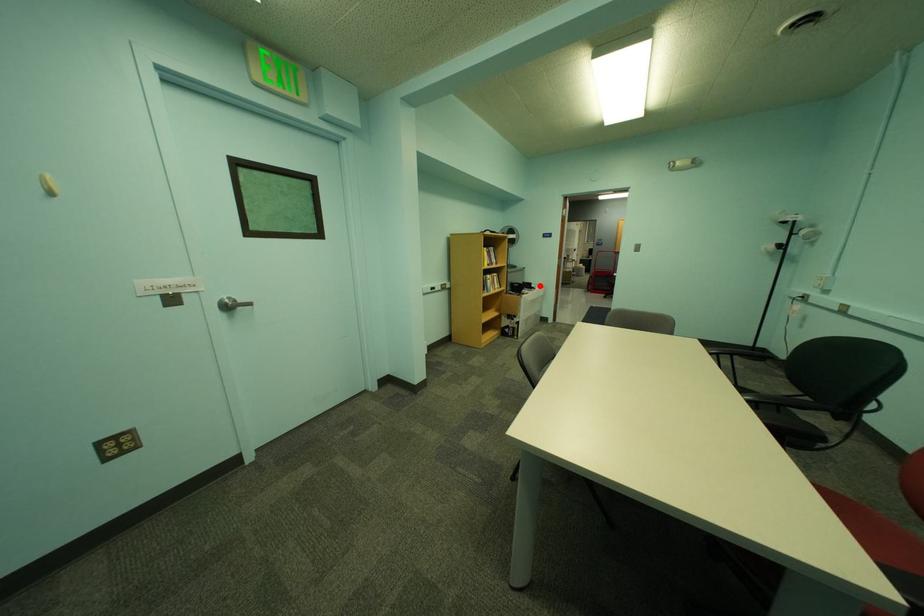
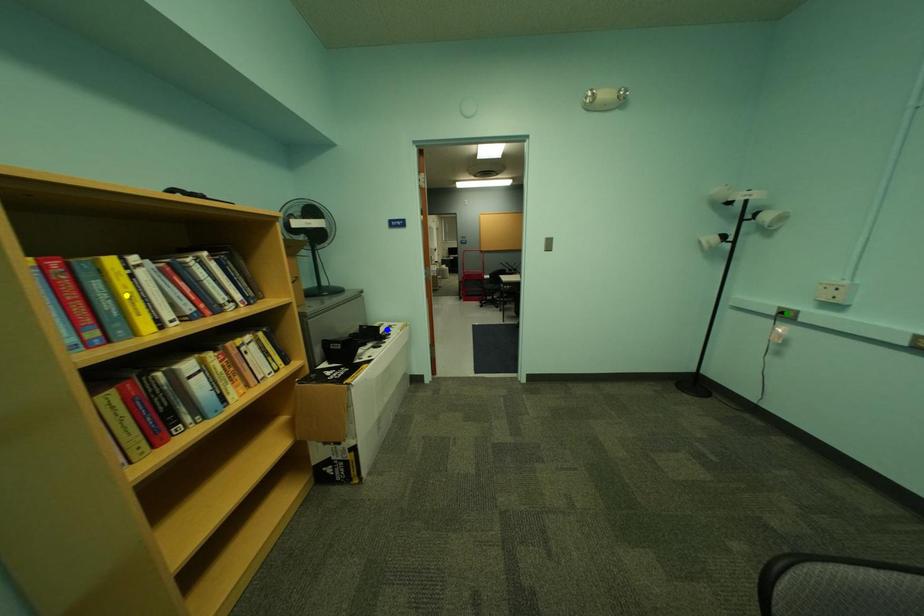
Question: I am providing you with two images of the same scene from different viewpoints. A red point is marked on the first image. You are given multiple points on the second image. Which spot in image 2 lines up with the point in image 1?

Choices:
 (A) blue point
 (B) green point
 (C) yellow point

Answer: (A)